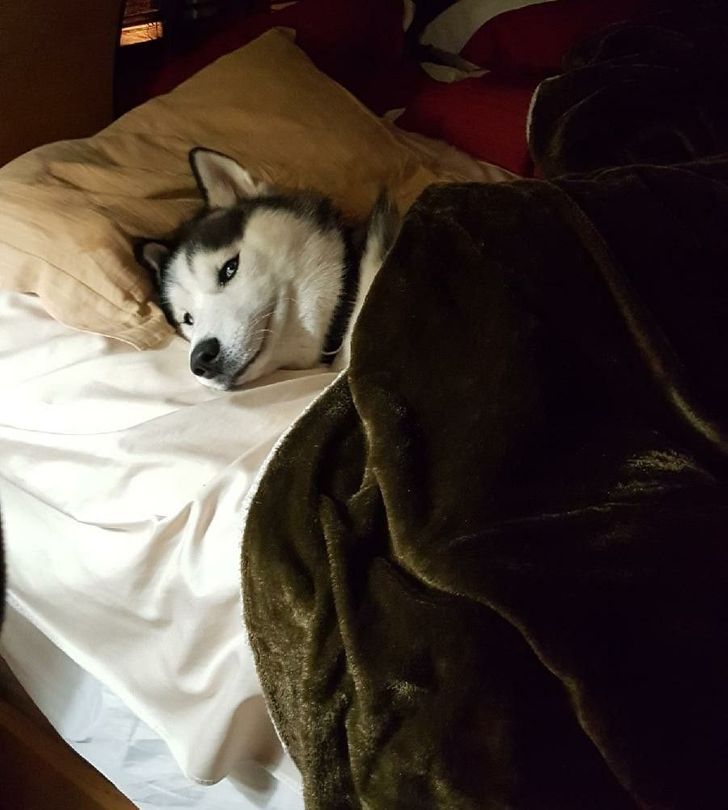
Identify the location of pillow. (78, 222).